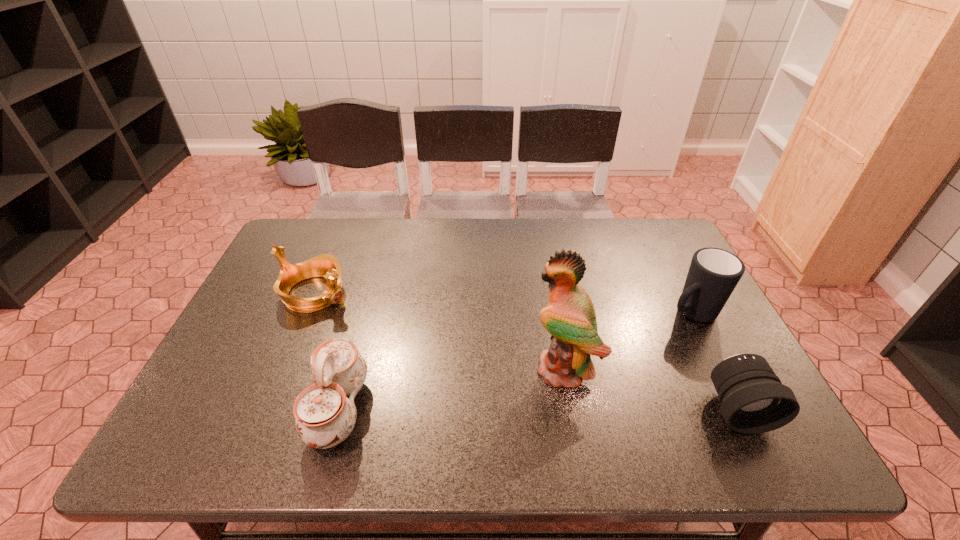
Where is `parrot present at the near edge`? parrot present at the near edge is located at coordinates (569, 317).

Find the location of a particular element. object located in the left edge section of the desktop is located at coordinates (326, 265).

Locate an element on the screen. The image size is (960, 540). telephoto lens that is at the right edge is located at coordinates tap(754, 400).

The height and width of the screenshot is (540, 960). I want to click on mug present at the right edge, so click(714, 273).

Identify the location of object located at the near right corner. This screenshot has height=540, width=960. (754, 400).

The image size is (960, 540). Find the location of `vacant area at the far edge of the desktop`. vacant area at the far edge of the desktop is located at coordinates (469, 234).

At what (x,y) coordinates should I click in order to perform the action: click on vacant space at the near edge of the desktop. Please return your answer as a coordinate pair (x, y). Looking at the image, I should click on 651,417.

In order to click on vacant space at the left edge of the desktop in this screenshot , I will do `click(223, 375)`.

This screenshot has width=960, height=540. I want to click on free region at the far left corner of the desktop, so click(x=298, y=232).

The height and width of the screenshot is (540, 960). In the image, there is a desktop. Identify the location of free region at the far right corner. (647, 240).